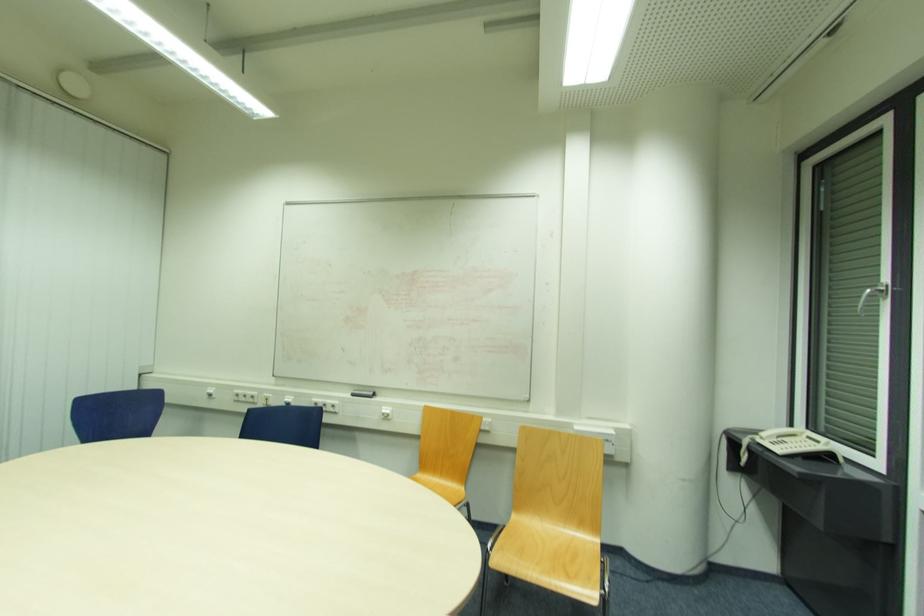
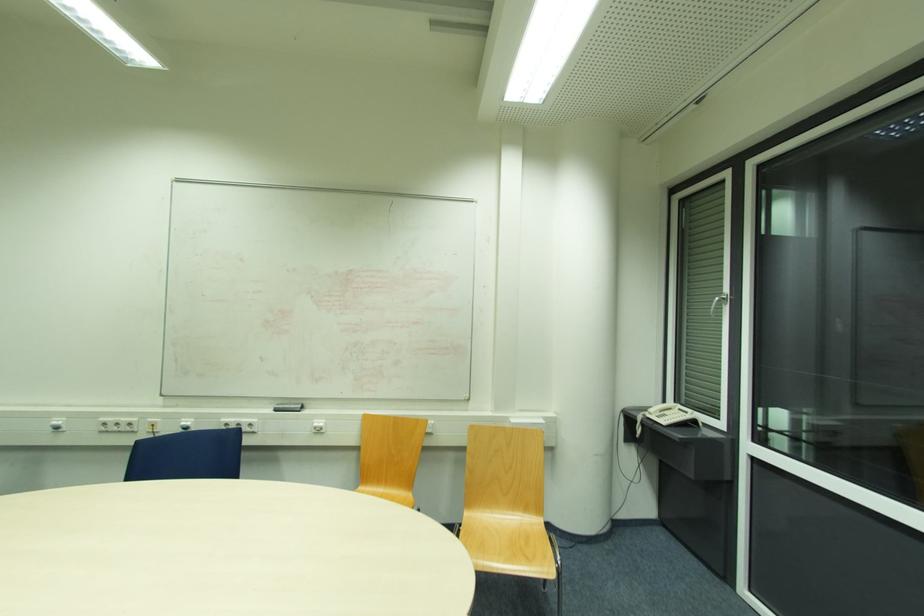
Where in the second image is the point corresponding to pixel 763 435 from the first image?

(652, 411)